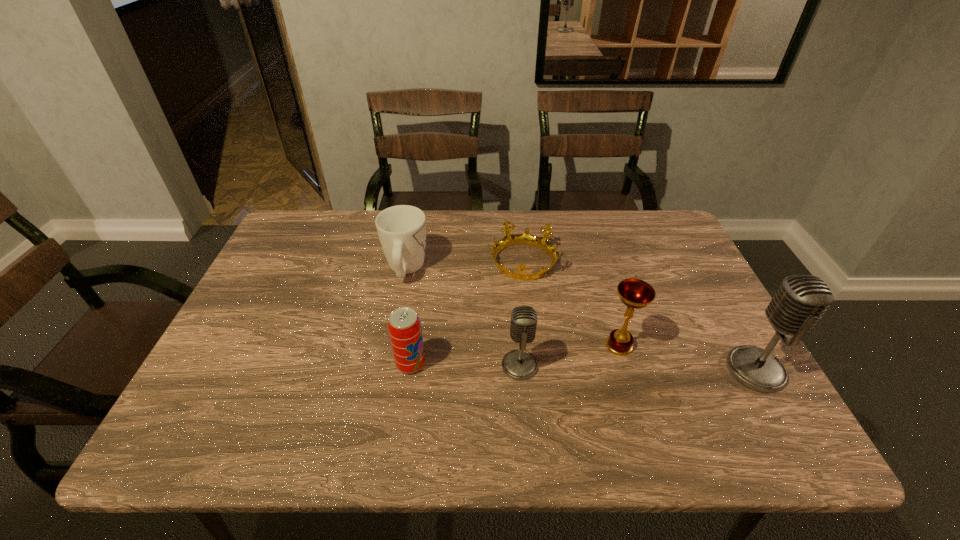
In the image, there is a desktop. What are the coordinates of `vacant space at the far edge` in the screenshot? It's located at (540, 254).

At what (x,y) coordinates should I click in order to perform the action: click on free location at the left edge. Please return your answer as a coordinate pair (x, y). Looking at the image, I should click on [324, 262].

In the image, there is a desktop. What are the coordinates of `vacant space at the right edge` in the screenshot? It's located at (660, 292).

This screenshot has width=960, height=540. In the image, there is a desktop. Find the location of `vacant space at the far left corner`. vacant space at the far left corner is located at coordinates pos(279,256).

The image size is (960, 540). I want to click on blank area at the far right corner, so click(x=687, y=255).

I want to click on free spot between the rightmost object and the second object from right to left, so click(687, 358).

At what (x,y) coordinates should I click in order to perform the action: click on free spot between the second object from right to left and the mug. Please return your answer as a coordinate pair (x, y). The width and height of the screenshot is (960, 540). Looking at the image, I should click on (513, 307).

You are a GUI agent. You are given a task and a screenshot of the screen. Output one action in this format:
    pyautogui.click(x=<x>, y=<y>)
    Task: Click on the unoccupied position between the soda can and the taller microphone
    
    Given the screenshot: What is the action you would take?
    pyautogui.click(x=583, y=367)

Identify the location of vacant area that lies between the mug and the fifth object from left to right. (513, 307).

You are a GUI agent. You are given a task and a screenshot of the screen. Output one action in this format:
    pyautogui.click(x=<x>, y=<y>)
    Task: Click on the vacant point located between the chalice and the shortest object
    The width and height of the screenshot is (960, 540).
    Given the screenshot: What is the action you would take?
    pyautogui.click(x=571, y=304)